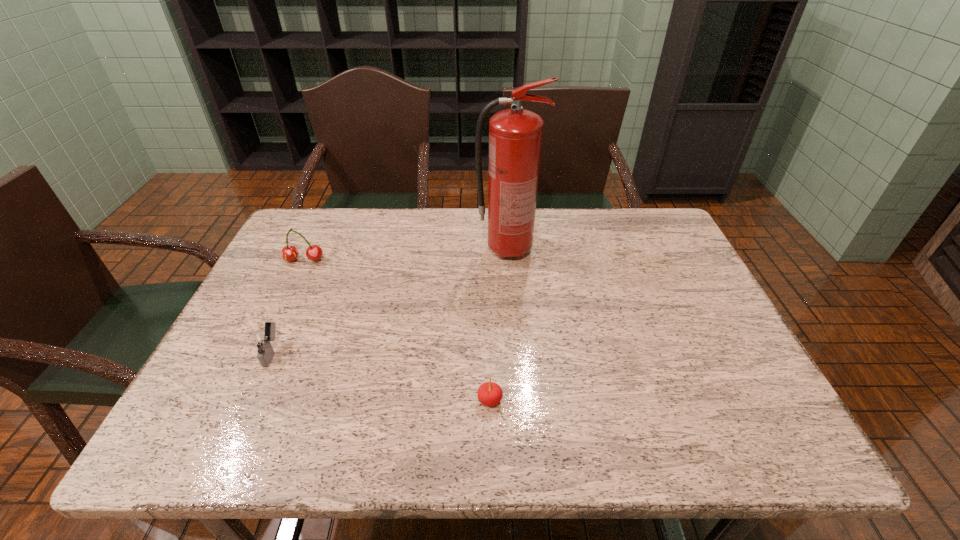
Locate an element on the screen. This screenshot has height=540, width=960. object that is at the far edge is located at coordinates (515, 135).

At what (x,y) coordinates should I click in order to perform the action: click on cherry situated at the left edge. Please return your answer as a coordinate pair (x, y). The width and height of the screenshot is (960, 540). Looking at the image, I should click on (289, 253).

The width and height of the screenshot is (960, 540). What are the coordinates of `igniter present at the left edge` in the screenshot? It's located at (260, 340).

Where is `vacant space at the far edge of the desktop`? vacant space at the far edge of the desktop is located at coordinates (548, 222).

This screenshot has height=540, width=960. In the image, there is a desktop. Identify the location of vacant space at the left edge. (294, 340).

Identify the location of vacant area at the right edge of the desktop. The height and width of the screenshot is (540, 960). (670, 270).

Find the location of a particular element. This screenshot has width=960, height=540. vacant space at the far left corner of the desktop is located at coordinates 318,231.

Locate an element on the screen. The width and height of the screenshot is (960, 540). vacant region at the near left corner of the desktop is located at coordinates (192, 437).

At what (x,y) coordinates should I click in order to perform the action: click on vacant space at the far right corner of the desktop. Please return your answer as a coordinate pair (x, y). The width and height of the screenshot is (960, 540). Looking at the image, I should click on (657, 218).

The image size is (960, 540). I want to click on blank region between the taller cherry and the shorter cherry, so click(396, 330).